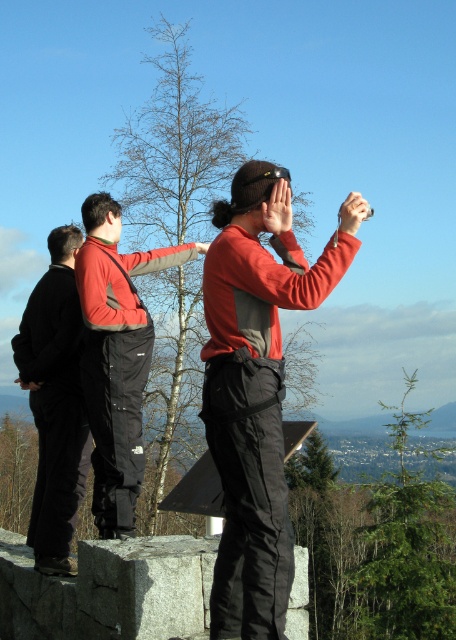
Question: Can you confirm if red fleece jacket at center is smaller than black softshell jacket at left?

Choices:
 (A) yes
 (B) no

Answer: (B)

Question: Is red fleece jacket at center to the left of black softshell jacket at left from the viewer's perspective?

Choices:
 (A) yes
 (B) no

Answer: (B)

Question: Which point appears closest to the camera in this image?

Choices:
 (A) (73, 353)
 (B) (129, 362)
 (C) (254, 198)

Answer: (C)

Question: Can you confirm if matte red jacket at center is positioned above black softshell jacket at left?

Choices:
 (A) no
 (B) yes

Answer: (B)

Question: Estimate the real-world distances between objects in this image. Which object is farther from the red fleece jacket at center?

Choices:
 (A) matte red jacket at center
 (B) black softshell jacket at left

Answer: (A)

Question: Which of the following is the farthest from the observer?

Choices:
 (A) (285, 212)
 (B) (62, 397)

Answer: (B)